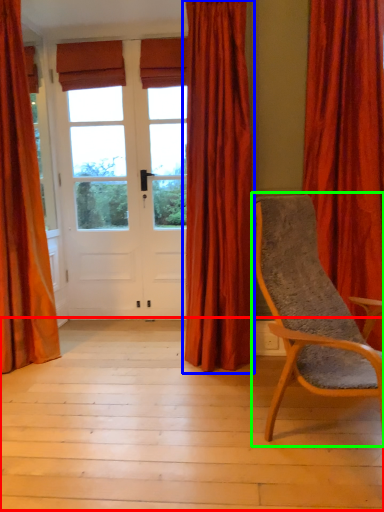
Question: Which object is the closest to the porch (highlighted by a red box)? Choose among these: curtain (highlighted by a blue box) or chair (highlighted by a green box).

Choices:
 (A) curtain
 (B) chair

Answer: (B)